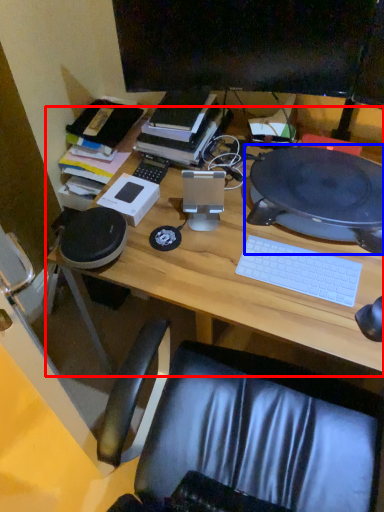
Question: Which point is closer to the camera, desk (highlighted by a red box) or computer (highlighted by a blue box)?

Choices:
 (A) desk
 (B) computer

Answer: (A)